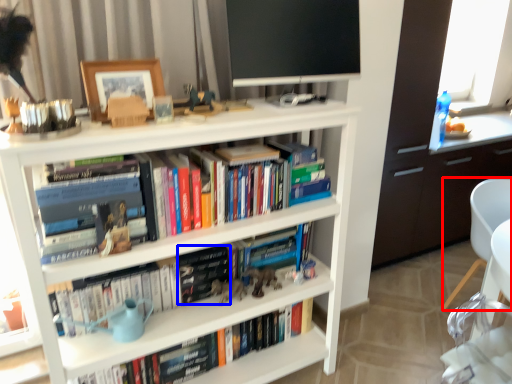
Question: Which of the following is the farthest to the observer, chair (highlighted by a red box) or paperback book (highlighted by a blue box)?

Choices:
 (A) chair
 (B) paperback book

Answer: (A)